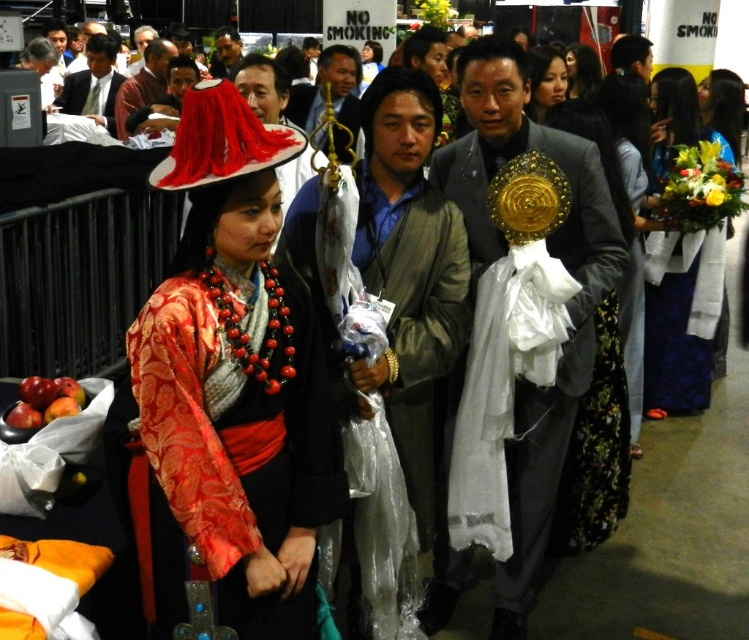
You are a photographer at the event and need to capture a group photo of the two women wearing the black satin dress at right and the matte black dress at center. The camera you are using has a minimum focus distance of 20 inches. Will you be able to take the photo without moving either of the subjects?

The black satin dress at right is 19.98 inches from the matte black dress at center, which is just below the camera minimum focus distance of 20 inches. Therefore, you will not be able to take the photo without moving the subjects closer together or further apart to meet the camera requirement.

You are a photographer positioned at the center of the image. You want to capture a photo of the black satin dress at right. Which direction should you move to get a better shot?

Since the black satin dress at right is located at point 0.350 on the x axis and 0.844 on the y axis, you should move to the left to align your camera with the dress.

You are a photographer at the event and want to capture a closeup of the shiny gold medallion at center and the matte black dress at center. Which object should you zoom in on first to ensure it fits in the frame?

The shiny gold medallion at center has a larger width than the matte black dress at center, so you should zoom in on the shiny gold medallion at center first to ensure it fits in the frame before adjusting for the smaller matte black dress at center.